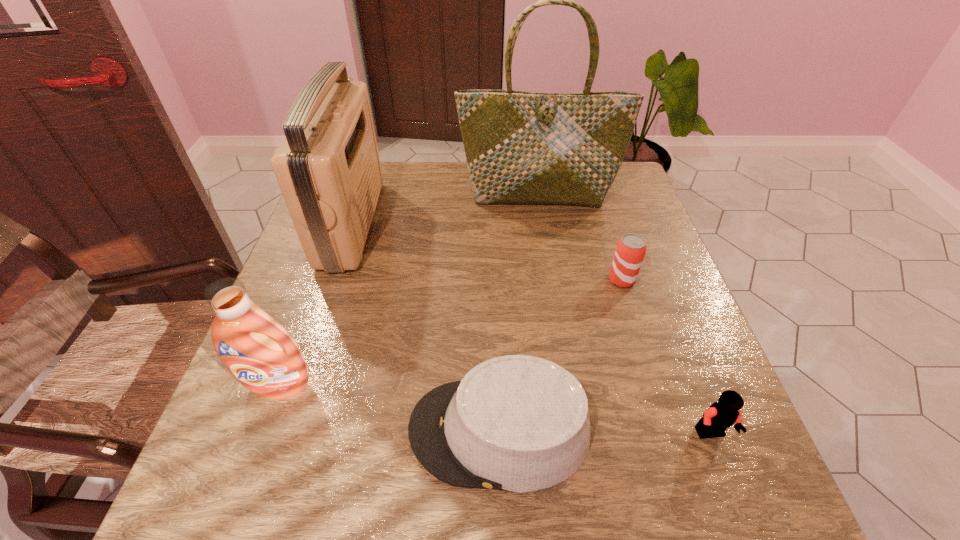
The height and width of the screenshot is (540, 960). I want to click on beer can that is at the right edge, so click(631, 248).

You are a GUI agent. You are given a task and a screenshot of the screen. Output one action in this format:
    pyautogui.click(x=<x>, y=<y>)
    Task: Click on the Lego present at the right edge
    
    Given the screenshot: What is the action you would take?
    pyautogui.click(x=721, y=415)

Where is `object that is at the far left corner`? The height and width of the screenshot is (540, 960). object that is at the far left corner is located at coordinates (328, 168).

Where is `object that is at the far right corner`? This screenshot has width=960, height=540. object that is at the far right corner is located at coordinates (521, 147).

This screenshot has width=960, height=540. What are the coordinates of `free space at the far edge of the desktop` in the screenshot? It's located at (386, 181).

Identify the location of vacant space at the right edge of the desktop. (646, 371).

I want to click on free space at the far left corner of the desktop, so click(x=383, y=165).

In order to click on free space that is in between the beer can and the Lego in this screenshot , I will do `click(666, 357)`.

You are a GUI agent. You are given a task and a screenshot of the screen. Output one action in this format:
    pyautogui.click(x=<x>, y=<y>)
    Task: Click on the unoccupied area between the fifth shortest object and the Lego
    This screenshot has width=960, height=540.
    Given the screenshot: What is the action you would take?
    pyautogui.click(x=532, y=329)

Where is `free space between the beer can and the hat`? Image resolution: width=960 pixels, height=540 pixels. free space between the beer can and the hat is located at coordinates (561, 355).